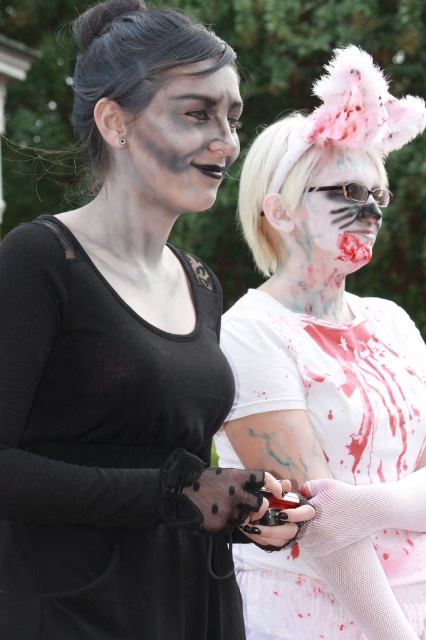
Question: Estimate the real-world distances between objects in this image. Which object is closer to the white mesh glove at right?

Choices:
 (A) white matte face paint at center
 (B) matte black dress at center

Answer: (A)

Question: Does white mesh glove at right come behind white matte face paint at center?

Choices:
 (A) no
 (B) yes

Answer: (A)

Question: Which object appears farthest from the camera in this image?

Choices:
 (A) white mesh glove at right
 (B) matte black dress at center
 (C) matte black face paint at center

Answer: (A)

Question: Does white mesh glove at right have a greater width compared to matte black face paint at center?

Choices:
 (A) yes
 (B) no

Answer: (A)

Question: Observing the image, what is the correct spatial positioning of white mesh glove at right in reference to matte black face paint at center?

Choices:
 (A) above
 (B) below

Answer: (B)

Question: Which point appears farthest from the camera in this image?

Choices:
 (A) (351, 60)
 (B) (155, 81)
 (C) (184, 177)

Answer: (A)